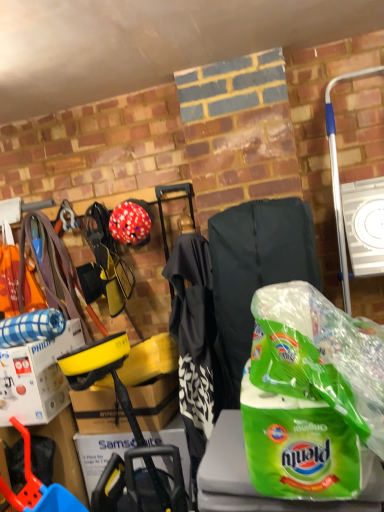
Question: Does green plastic bag at center have a larger size compared to matte red helmet at center?

Choices:
 (A) yes
 (B) no

Answer: (A)

Question: From a real-world perspective, is green plastic bag at center positioned over matte red helmet at center based on gravity?

Choices:
 (A) yes
 (B) no

Answer: (B)

Question: Does green plastic bag at center contain matte red helmet at center?

Choices:
 (A) no
 (B) yes

Answer: (A)

Question: From the image's perspective, does green plastic bag at center appear higher than matte red helmet at center?

Choices:
 (A) no
 (B) yes

Answer: (A)

Question: Considering the relative sizes of green plastic bag at center and matte red helmet at center in the image provided, is green plastic bag at center shorter than matte red helmet at center?

Choices:
 (A) no
 (B) yes

Answer: (A)

Question: From a real-world perspective, is matte red helmet at center physically located above or below white cardboard box at left?

Choices:
 (A) above
 (B) below

Answer: (A)

Question: Is matte red helmet at center to the left or to the right of white cardboard box at left in the image?

Choices:
 (A) right
 (B) left

Answer: (A)

Question: In terms of width, does matte red helmet at center look wider or thinner when compared to white cardboard box at left?

Choices:
 (A) wide
 (B) thin

Answer: (B)

Question: Based on their sizes in the image, would you say matte red helmet at center is bigger or smaller than white cardboard box at left?

Choices:
 (A) big
 (B) small

Answer: (B)

Question: Would you say white cardboard box at left is to the left or to the right of green plastic bag at center in the picture?

Choices:
 (A) left
 (B) right

Answer: (A)

Question: From a real-world perspective, is white cardboard box at left physically located above or below green plastic bag at center?

Choices:
 (A) above
 (B) below

Answer: (B)

Question: Considering the positions of white cardboard box at left and green plastic bag at center in the image, is white cardboard box at left wider or thinner than green plastic bag at center?

Choices:
 (A) thin
 (B) wide

Answer: (A)

Question: Relative to green plastic bag at center, is white cardboard box at left in front or behind?

Choices:
 (A) front
 (B) behind

Answer: (B)

Question: Looking at the image, does green plastic bag at center seem bigger or smaller compared to white cardboard box at left?

Choices:
 (A) small
 (B) big

Answer: (B)

Question: Based on their positions, is green plastic bag at center located to the left or right of white cardboard box at left?

Choices:
 (A) left
 (B) right

Answer: (B)